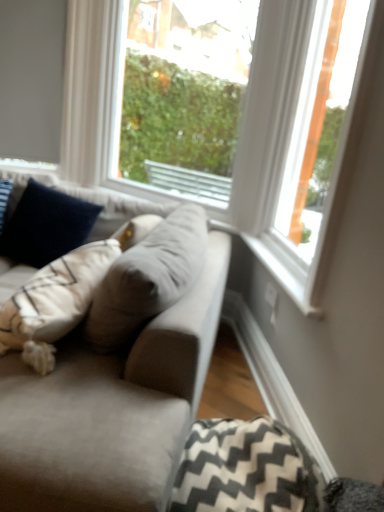
Question: Is transparent glass window at center, which is counted as the 2th window, starting from the right, behind velvety navy blue pillow at left, the 1th pillow viewed from the top?

Choices:
 (A) no
 (B) yes

Answer: (B)

Question: Is transparent glass window at center, which is counted as the 2th window, starting from the right, completely or partially outside of velvety navy blue pillow at left, which appears as the 2th pillow when viewed from the front?

Choices:
 (A) yes
 (B) no

Answer: (A)

Question: Considering the relative sizes of transparent glass window at center, the first window in the left-to-right sequence, and velvety navy blue pillow at left, which is the first pillow from left to right, in the image provided, is transparent glass window at center, the first window in the left-to-right sequence, smaller than velvety navy blue pillow at left, which is the first pillow from left to right,?

Choices:
 (A) yes
 (B) no

Answer: (B)

Question: From a real-world perspective, is transparent glass window at center, the first window in the left-to-right sequence, located higher than velvety navy blue pillow at left, the second pillow in the right-to-left sequence?

Choices:
 (A) no
 (B) yes

Answer: (B)

Question: Is transparent glass window at center, which is counted as the 2th window, starting from the right, shorter than velvety navy blue pillow at left, which appears as the 2th pillow when viewed from the front?

Choices:
 (A) yes
 (B) no

Answer: (B)

Question: From the image's perspective, is suede gray couch at center located above or below black-and-white zigzag fabric pillow at lower right, which is the second pillow from left to right?

Choices:
 (A) above
 (B) below

Answer: (A)

Question: Which is correct: suede gray couch at center is inside black-and-white zigzag fabric pillow at lower right, placed as the 2th pillow when sorted from back to front, or outside of it?

Choices:
 (A) inside
 (B) outside

Answer: (B)

Question: Based on their sizes in the image, would you say suede gray couch at center is bigger or smaller than black-and-white zigzag fabric pillow at lower right, which appears as the first pillow when viewed from the front?

Choices:
 (A) small
 (B) big

Answer: (B)

Question: In terms of width, does suede gray couch at center look wider or thinner when compared to black-and-white zigzag fabric pillow at lower right, placed as the 2th pillow when sorted from back to front?

Choices:
 (A) wide
 (B) thin

Answer: (A)

Question: From a real-world perspective, is white wood frame at upper right, acting as the first window starting from the right, above or below transparent glass window at center, the first window in the left-to-right sequence?

Choices:
 (A) below
 (B) above

Answer: (A)

Question: From the image's perspective, is white wood frame at upper right, which is counted as the 2th window, starting from the left, positioned above or below transparent glass window at center, the first window in the left-to-right sequence?

Choices:
 (A) above
 (B) below

Answer: (B)

Question: Is white wood frame at upper right, which is counted as the 2th window, starting from the left, spatially inside transparent glass window at center, the first window in the left-to-right sequence, or outside of it?

Choices:
 (A) inside
 (B) outside

Answer: (B)

Question: Is white wood frame at upper right, which is counted as the 2th window, starting from the left, bigger or smaller than transparent glass window at center, the first window in the left-to-right sequence?

Choices:
 (A) big
 (B) small

Answer: (B)

Question: Considering the relative positions of white wood frame at upper right, which is counted as the 2th window, starting from the left, and black-and-white zigzag fabric pillow at lower right, acting as the second pillow starting from the top, in the image provided, is white wood frame at upper right, which is counted as the 2th window, starting from the left, to the left or to the right of black-and-white zigzag fabric pillow at lower right, acting as the second pillow starting from the top,?

Choices:
 (A) right
 (B) left

Answer: (A)

Question: From a real-world perspective, is white wood frame at upper right, which is counted as the 2th window, starting from the left, physically located above or below black-and-white zigzag fabric pillow at lower right, the first pillow viewed from the right?

Choices:
 (A) above
 (B) below

Answer: (A)